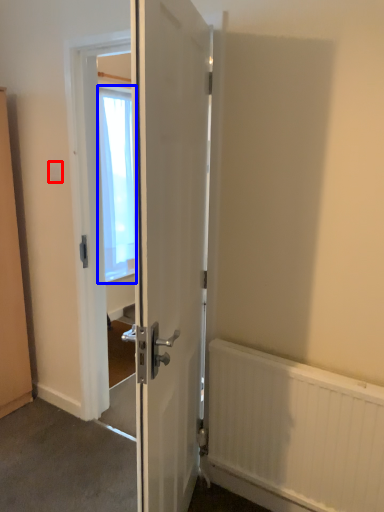
Question: Which object is closer to the camera taking this photo, electric outlet (highlighted by a red box) or window screen (highlighted by a blue box)?

Choices:
 (A) electric outlet
 (B) window screen

Answer: (A)